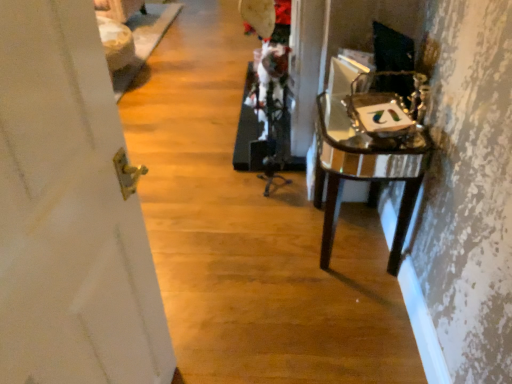
Describe the element at coordinates (364, 173) in the screenshot. I see `glossy glass table at right` at that location.

Find the location of a particular element. glossy glass table at right is located at coordinates (364, 173).

Image resolution: width=512 pixels, height=384 pixels. Identify the location of glossy glass table at right. (364, 173).